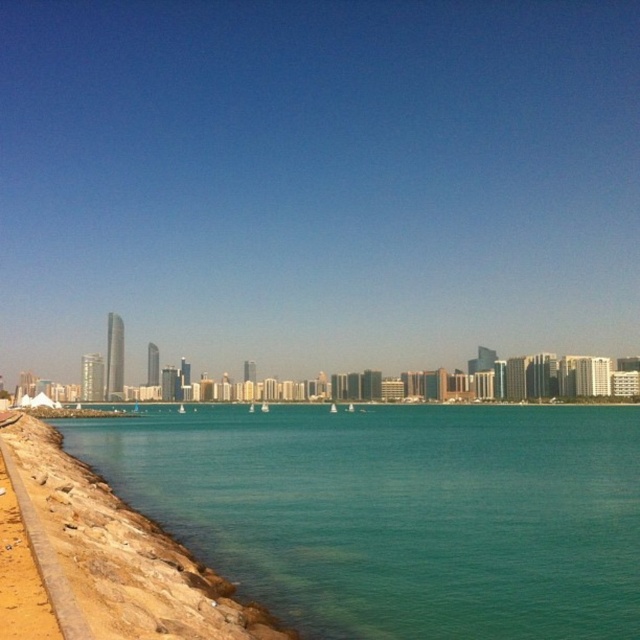
Measure the distance from teal smooth water at lower left to brown rocky shoreline at lower left.

They are 57.01 meters apart.

Is the position of teal smooth water at lower left less distant than that of brown rocky shoreline at lower left?

No.

The width and height of the screenshot is (640, 640). Find the location of `teal smooth water at lower left`. teal smooth water at lower left is located at coordinates (396, 513).

The height and width of the screenshot is (640, 640). Identify the location of teal smooth water at lower left. (396, 513).